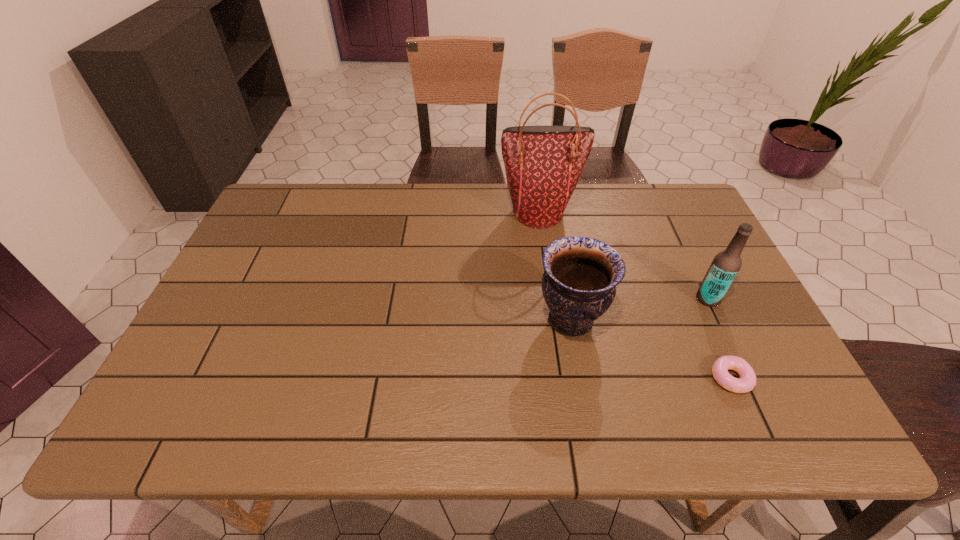
The height and width of the screenshot is (540, 960). What are the coordinates of `free space between the shortest object and the handbag` in the screenshot? It's located at (635, 295).

Choose which object is the third nearest neighbor to the pottery. Please provide its 2D coordinates. Your answer should be formatted as a tuple, i.e. [(x, y)], where the tuple contains the x and y coordinates of a point satisfying the conditions above.

[(543, 164)]

Find the location of a particular element. Image resolution: width=960 pixels, height=540 pixels. object that can be found as the third closest to the doughnut is located at coordinates (543, 164).

Where is `free spot that satisfies the following two spatial constraints: 1. on the front handle of the shortest object; 2. on the left side of the pottery`? This screenshot has width=960, height=540. free spot that satisfies the following two spatial constraints: 1. on the front handle of the shortest object; 2. on the left side of the pottery is located at coordinates pos(581,379).

Identify the location of free spot that satisfies the following two spatial constraints: 1. on the side of the beer bottle with the label; 2. on the front side of the nearest object. (746, 379).

Image resolution: width=960 pixels, height=540 pixels. What are the coordinates of `free region that satisfies the following two spatial constraints: 1. on the front handle of the third tallest object; 2. on the back side of the doughnut` in the screenshot? It's located at (581, 379).